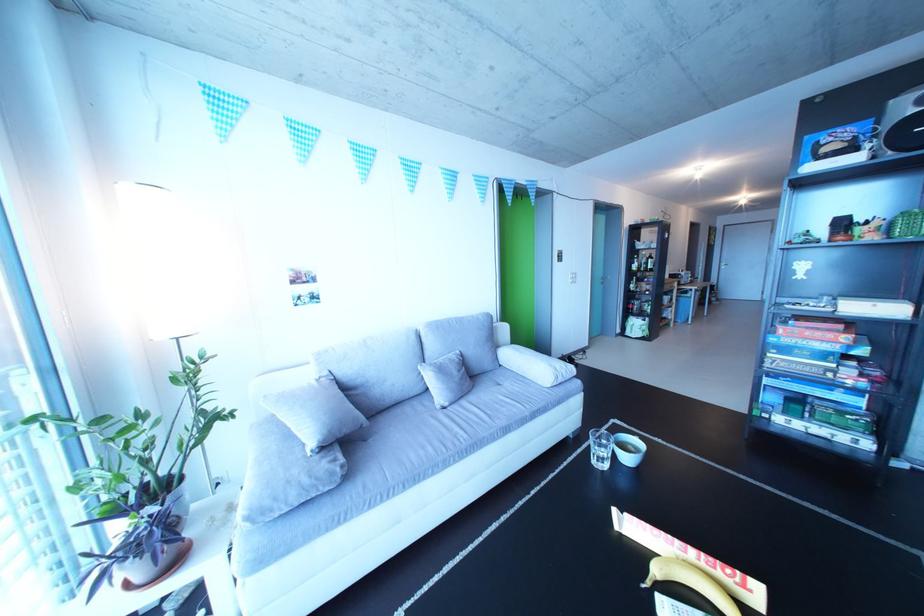
I want to click on glass bottle, so click(x=642, y=282).